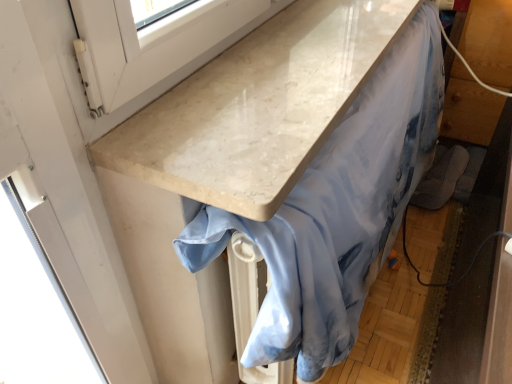
Question: Is light blue satin fabric at center oriented away from white marble countertop at upper center?

Choices:
 (A) no
 (B) yes

Answer: (A)

Question: Is light blue satin fabric at center oriented towards white marble countertop at upper center?

Choices:
 (A) no
 (B) yes

Answer: (A)

Question: Is light blue satin fabric at center at the right side of white marble countertop at upper center?

Choices:
 (A) no
 (B) yes

Answer: (B)

Question: Is light blue satin fabric at center completely or partially outside of white marble countertop at upper center?

Choices:
 (A) no
 (B) yes

Answer: (B)

Question: Would you consider light blue satin fabric at center to be distant from white marble countertop at upper center?

Choices:
 (A) yes
 (B) no

Answer: (B)

Question: Is light blue satin fabric at center shorter than white marble countertop at upper center?

Choices:
 (A) yes
 (B) no

Answer: (B)

Question: From the image's perspective, is white marble countertop at upper center located above light blue satin fabric at center?

Choices:
 (A) no
 (B) yes

Answer: (B)

Question: From a real-world perspective, is white marble countertop at upper center located beneath light blue satin fabric at center?

Choices:
 (A) no
 (B) yes

Answer: (A)

Question: Does white marble countertop at upper center have a smaller size compared to light blue satin fabric at center?

Choices:
 (A) no
 (B) yes

Answer: (B)

Question: From the image's perspective, is white marble countertop at upper center below light blue satin fabric at center?

Choices:
 (A) no
 (B) yes

Answer: (A)

Question: Is white marble countertop at upper center to the left of light blue satin fabric at center from the viewer's perspective?

Choices:
 (A) yes
 (B) no

Answer: (A)

Question: From a real-world perspective, is white marble countertop at upper center on light blue satin fabric at center?

Choices:
 (A) yes
 (B) no

Answer: (A)

Question: Is light blue satin fabric at center to the left or to the right of white marble countertop at upper center in the image?

Choices:
 (A) left
 (B) right

Answer: (B)